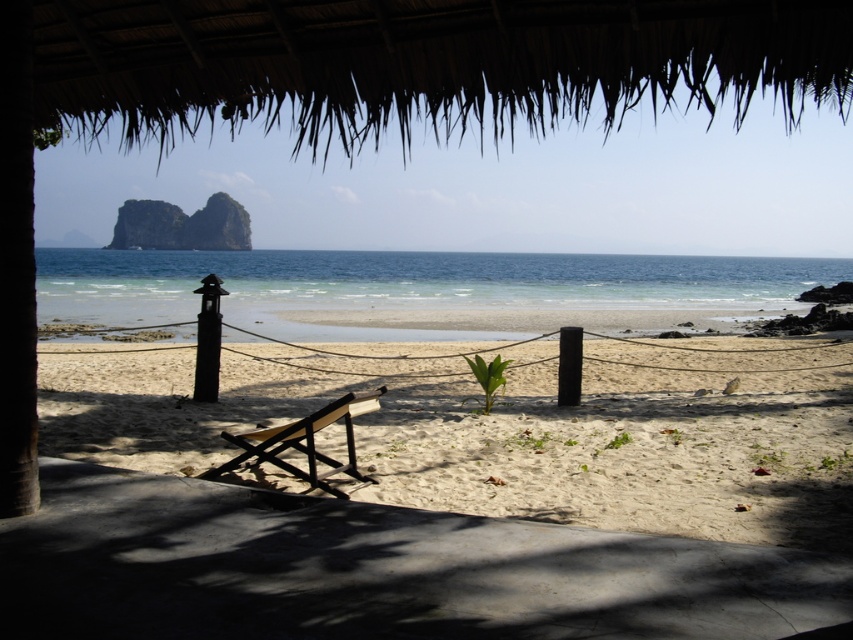
Is point (430, 396) behind point (206, 397)?

Yes, point (430, 396) is farther from viewer.

Which is more to the right, light beige sand at center or black wood pole at left?

light beige sand at center

Does point (605, 384) come in front of point (218, 371)?

No, (605, 384) is further to viewer.

Locate an element on the screen. light beige sand at center is located at coordinates (502, 436).

Between light beige sand at center and black matte pole at center, which one is positioned higher?

Positioned higher is black matte pole at center.

Which is below, light beige sand at center or black matte pole at center?

light beige sand at center is below.

Is point (786, 516) closer to viewer compared to point (579, 371)?

Yes, it is in front of point (579, 371).

Image resolution: width=853 pixels, height=640 pixels. I want to click on light beige sand at center, so (x=502, y=436).

Can you confirm if wooden chair at center is positioned to the right of black matte pole at center?

Incorrect, wooden chair at center is not on the right side of black matte pole at center.

Between point (306, 449) and point (577, 364), which one is positioned in front?

Positioned in front is point (306, 449).

Where is `wooden chair at center`? wooden chair at center is located at coordinates (305, 444).